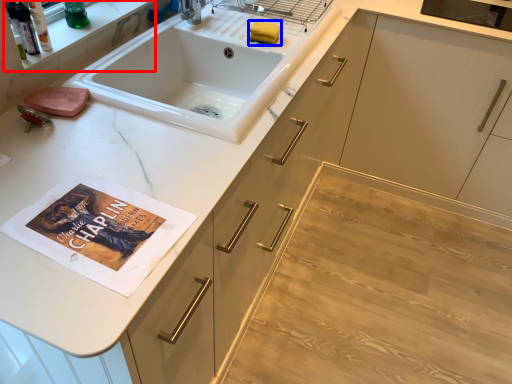
Question: Which point is further to the camera, shelf (highlighted by a red box) or soap (highlighted by a blue box)?

Choices:
 (A) shelf
 (B) soap

Answer: (B)